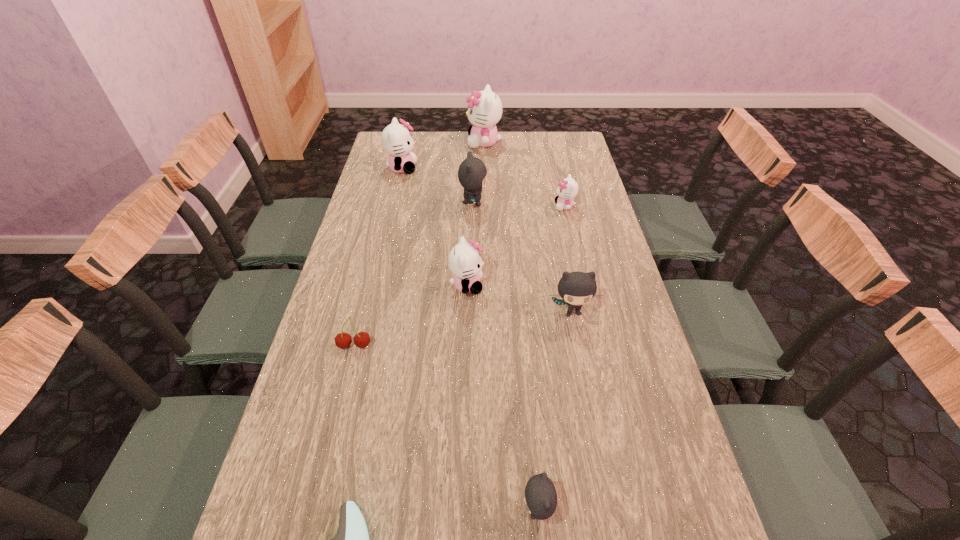
Where is `the biggest white kitten`? Image resolution: width=960 pixels, height=540 pixels. the biggest white kitten is located at coordinates (485, 108).

What are the coordinates of `the tallest kitten` in the screenshot? It's located at [485, 108].

Identify the location of the leftmost kitten. This screenshot has width=960, height=540. (397, 141).

Where is `the eighth nearest object`? This screenshot has width=960, height=540. the eighth nearest object is located at coordinates (397, 141).

The width and height of the screenshot is (960, 540). Find the location of `the biggest gray kitten`. the biggest gray kitten is located at coordinates (472, 173).

The width and height of the screenshot is (960, 540). I want to click on the leftmost gray kitten, so click(x=472, y=173).

Locate an element on the screen. The width and height of the screenshot is (960, 540). the nearest white kitten is located at coordinates (464, 260).

Locate an element on the screen. This screenshot has width=960, height=540. the second smallest gray kitten is located at coordinates (576, 288).

Find the location of a particular element. This screenshot has width=960, height=540. the rightmost gray kitten is located at coordinates (576, 288).

At what (x,y) coordinates should I click in order to perform the action: click on the smallest white kitten. Please return your answer as a coordinate pair (x, y). The width and height of the screenshot is (960, 540). Looking at the image, I should click on (567, 189).